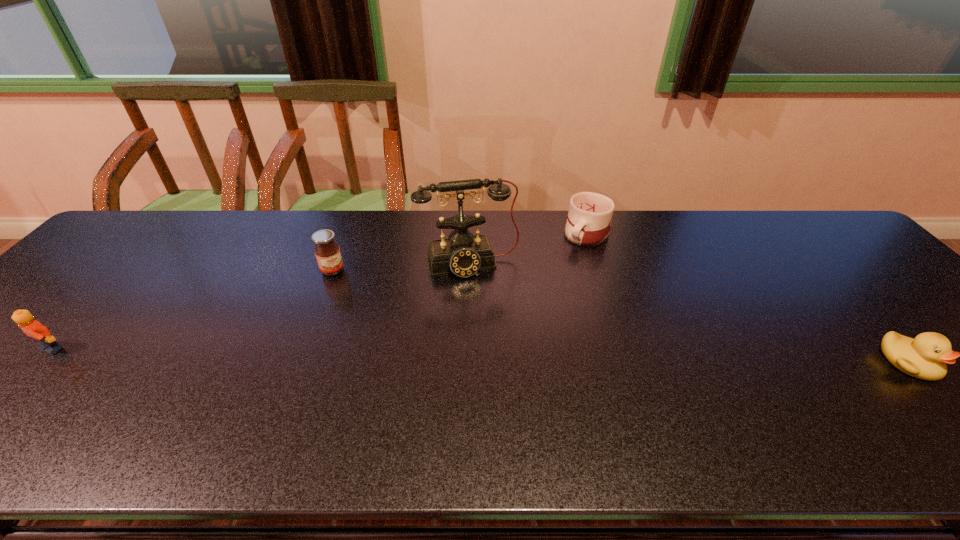
Find the location of a particular element. The height and width of the screenshot is (540, 960). the leftmost object is located at coordinates (32, 328).

Identify the location of duckling. (925, 357).

This screenshot has height=540, width=960. I want to click on the tallest object, so click(464, 254).

The image size is (960, 540). What are the coordinates of `telephone` in the screenshot? It's located at (464, 254).

This screenshot has height=540, width=960. Identify the location of the second object from left to right. (327, 252).

The height and width of the screenshot is (540, 960). I want to click on the fourth object from left to right, so click(x=590, y=214).

Find the location of a particular element. The image size is (960, 540). free region located on the front-facing side of the leftmost object is located at coordinates (18, 385).

The height and width of the screenshot is (540, 960). Find the location of `blank space located 0.050m on the front-facing side of the rightmost object`. blank space located 0.050m on the front-facing side of the rightmost object is located at coordinates (947, 403).

What are the coordinates of `vacant space located 0.220m on the dial of the telephone` in the screenshot? It's located at (495, 340).

You are a GUI agent. You are given a task and a screenshot of the screen. Output one action in this format:
    pyautogui.click(x=<x>, y=<y>)
    Task: Click on the vacant area situated 0.180m on the dial of the telephone
    
    Given the screenshot: What is the action you would take?
    pyautogui.click(x=492, y=327)